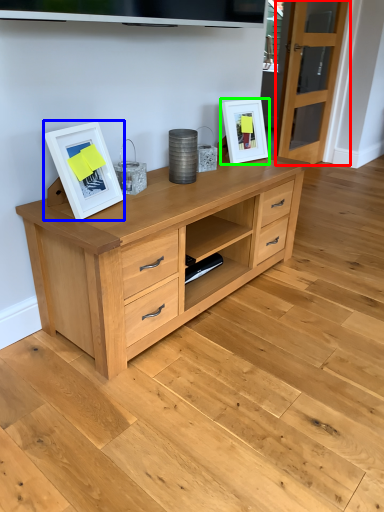
Question: Considering the real-world distances, which object is farthest from glass door (highlighted by a red box)? picture frame (highlighted by a blue box) or picture frame (highlighted by a green box)?

Choices:
 (A) picture frame
 (B) picture frame

Answer: (A)